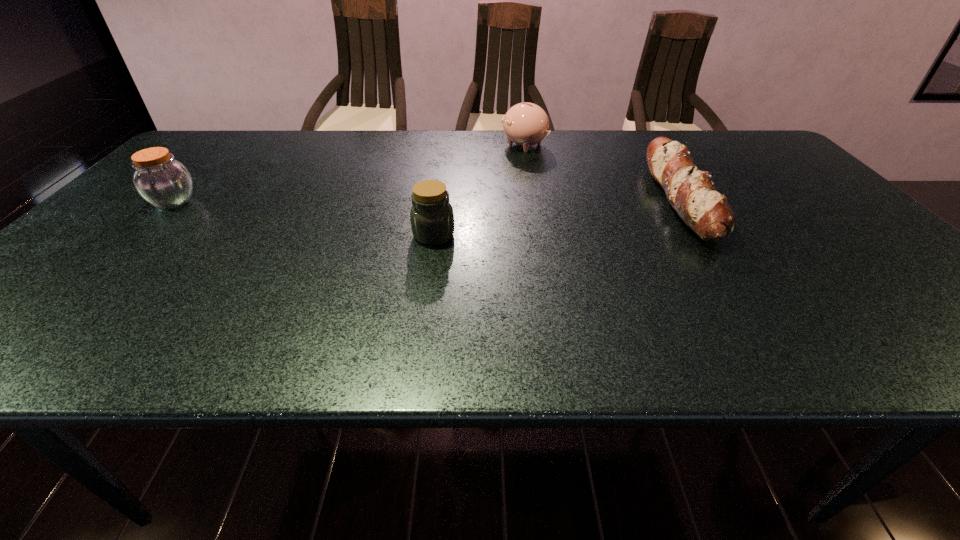
Find the location of a particular element. Image resolution: width=960 pixels, height=540 pixels. the farther jar is located at coordinates (165, 183).

Find the location of `the left jar`. the left jar is located at coordinates (165, 183).

You are a GUI agent. You are given a task and a screenshot of the screen. Output one action in this format:
    pyautogui.click(x=<x>, y=<y>)
    Task: Click on the farthest object
    The image size is (960, 540).
    Given the screenshot: What is the action you would take?
    point(526,124)

Locate an element on the screen. This screenshot has width=960, height=540. piggy bank is located at coordinates (526, 124).

At what (x,y) coordinates should I click in order to perform the action: click on the nearer jar. Please return your answer as a coordinate pair (x, y). Looking at the image, I should click on point(432,219).

I want to click on the right jar, so click(432, 219).

The width and height of the screenshot is (960, 540). Identify the location of baguet. (691, 192).

Where is `the rightmost object`? the rightmost object is located at coordinates (691, 192).

Identify the location of vacant space located on the front of the left jar. The width and height of the screenshot is (960, 540). (143, 233).

Where is `free region located 0.090m on the front of the second object from right to left`? The height and width of the screenshot is (540, 960). free region located 0.090m on the front of the second object from right to left is located at coordinates (528, 168).